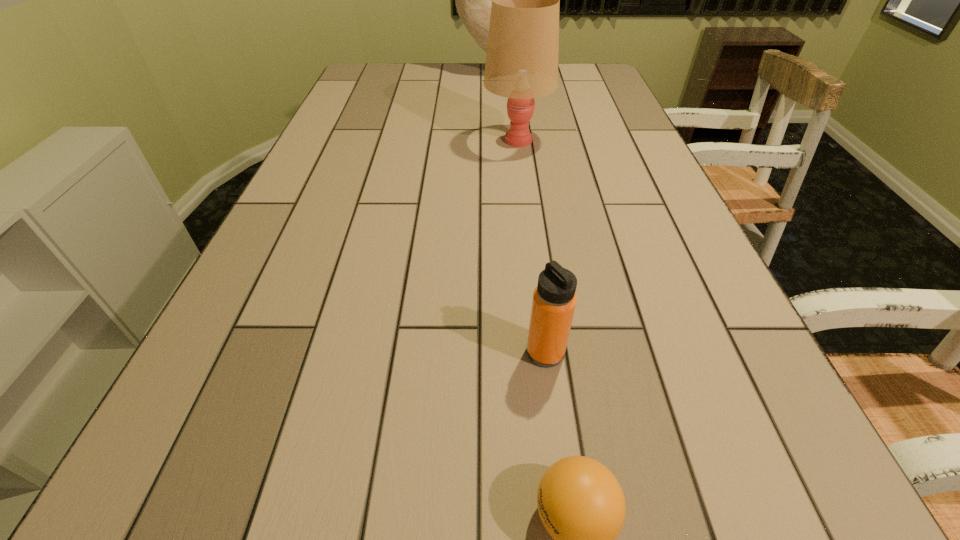
Image resolution: width=960 pixels, height=540 pixels. Find the location of `parakeet`. parakeet is located at coordinates (473, 0).

Locate an element on the screen. The width and height of the screenshot is (960, 540). the third nearest object is located at coordinates (521, 64).

You are a GUI agent. You are given a task and a screenshot of the screen. Output one action in this format:
    pyautogui.click(x=<x>, y=<y>)
    Task: Click on the third farthest object
    The image size is (960, 540).
    Given the screenshot: What is the action you would take?
    pyautogui.click(x=554, y=300)

Identify the location of the third tallest object. point(554,300).

You are a GUI agent. You are given a task and a screenshot of the screen. Output one action in this format:
    pyautogui.click(x=<x>, y=<y>)
    Task: Click on the free region located on the face of the farthest object
    The width and height of the screenshot is (960, 540).
    Given the screenshot: What is the action you would take?
    pyautogui.click(x=389, y=73)

At what (x,y) coordinates should I click in order to perform the action: click on vacant space situated on the face of the farthest object. Please return your answer as a coordinate pair (x, y). Looking at the image, I should click on (355, 73).

The height and width of the screenshot is (540, 960). In order to click on free spot located 0.080m on the face of the farthest object in this screenshot , I will do `click(422, 73)`.

This screenshot has width=960, height=540. Identify the location of free space located 0.270m on the back of the third nearest object. (511, 87).

This screenshot has width=960, height=540. Identify the location of free space located on the front of the thermos bottle. (556, 435).

Locate an element on the screen. object that is positioned at the far edge is located at coordinates (473, 0).